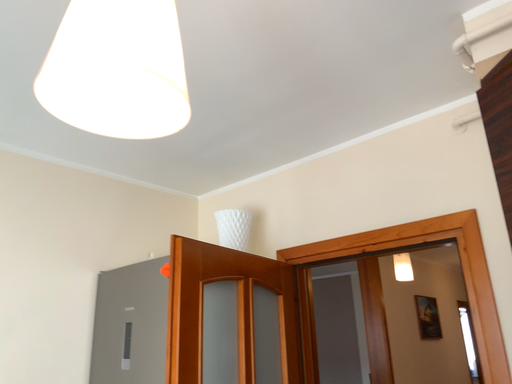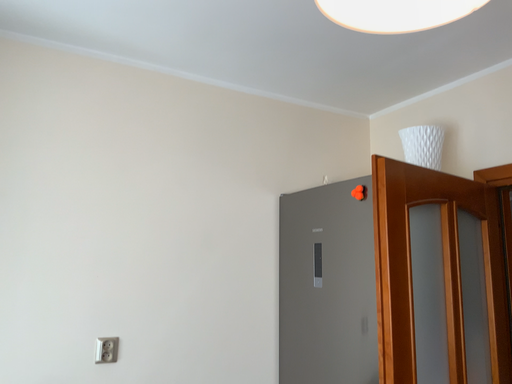
Question: Which way did the camera rotate in the video?

Choices:
 (A) rotated upward
 (B) rotated downward

Answer: (B)